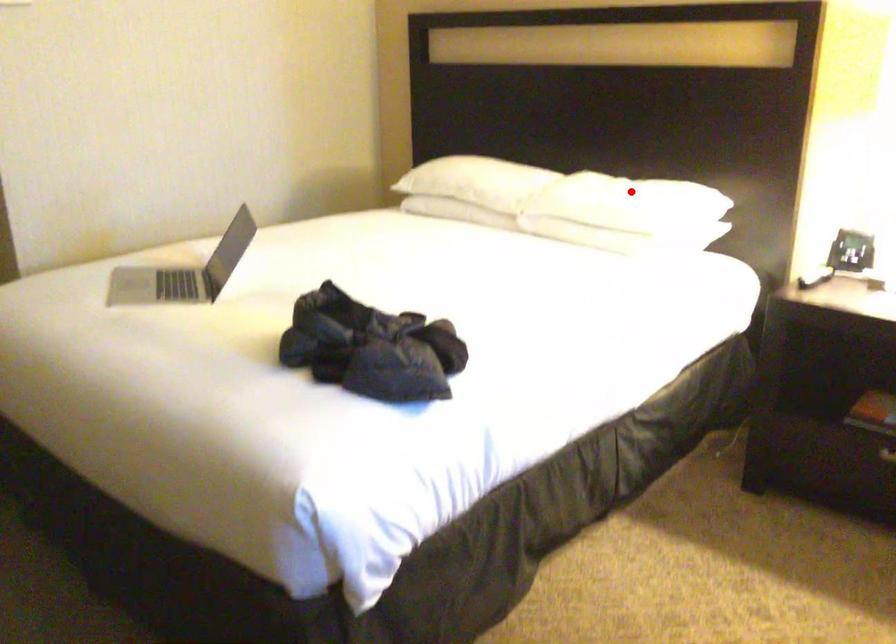
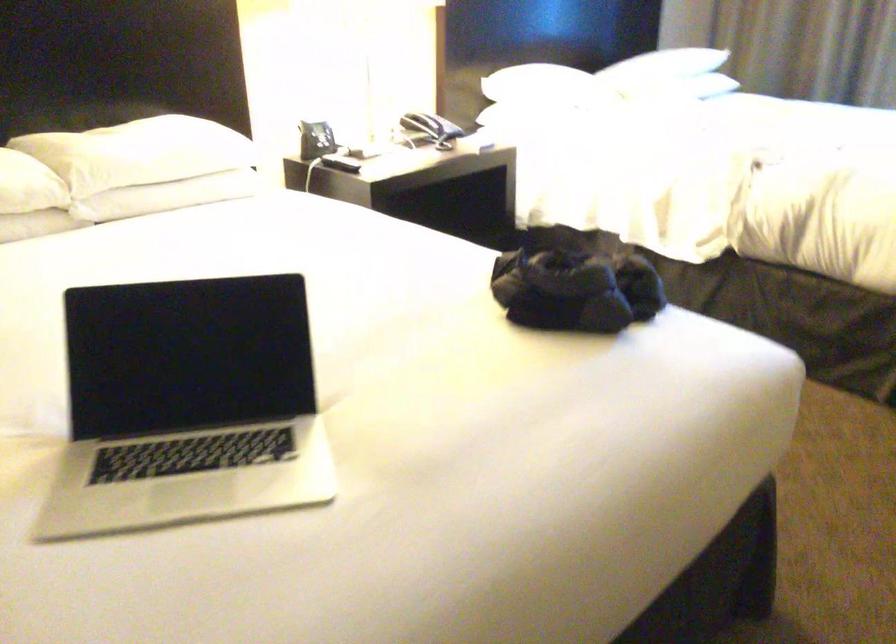
Find the pixel in the second image that matches the highlighted location in the first image.

(186, 136)